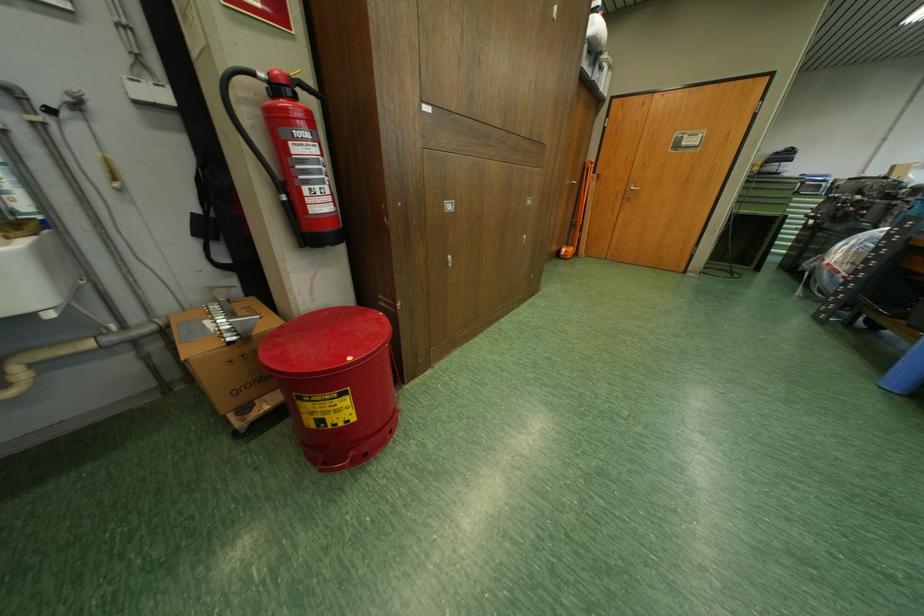
What do you see at coordinates (631, 190) in the screenshot?
I see `the silver door handle` at bounding box center [631, 190].